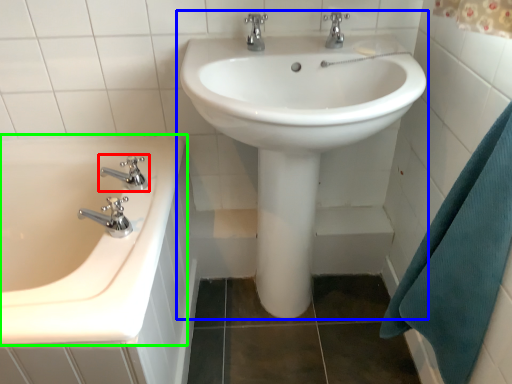
Question: Considering the real-world distances, which object is closest to tap (highlighted by a red box)? sink (highlighted by a blue box) or bathtub (highlighted by a green box).

Choices:
 (A) sink
 (B) bathtub

Answer: (B)